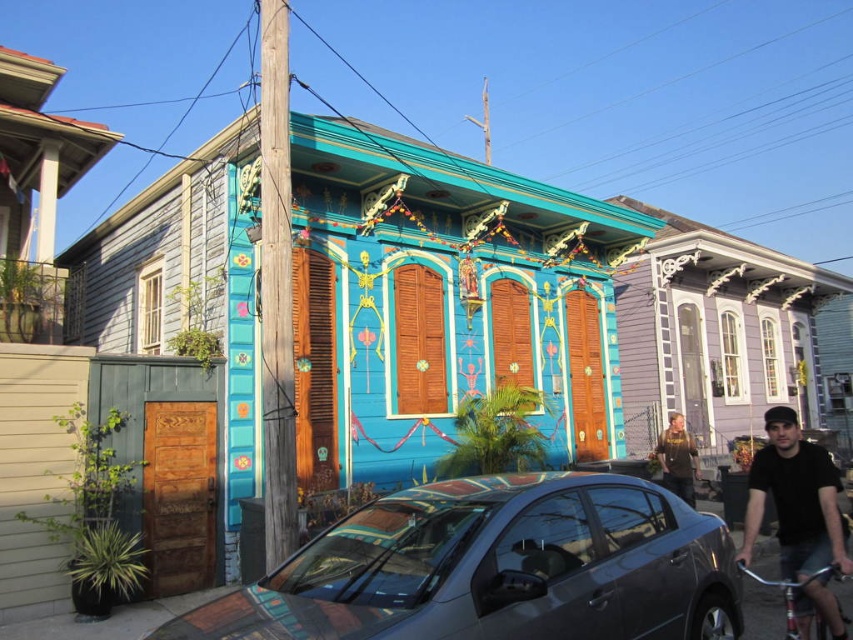
Question: Which point is closer to the camera?

Choices:
 (A) silver metallic bicycle at lower right
 (B) dark brown leather jacket at center
 (C) satin black car at center

Answer: (C)

Question: Which point is closer to the camera?

Choices:
 (A) (582, 589)
 (B) (659, 442)
 (C) (796, 612)
 (D) (834, 556)

Answer: (A)

Question: From the image, what is the correct spatial relationship of satin black car at center in relation to silver metallic bicycle at lower right?

Choices:
 (A) above
 (B) below

Answer: (A)

Question: Which of the following is the closest to the observer?

Choices:
 (A) dark brown leather jacket at center
 (B) silver metallic bicycle at lower right

Answer: (B)

Question: Is dark brown leather jacket at center bigger than silver metallic bicycle at lower right?

Choices:
 (A) yes
 (B) no

Answer: (A)

Question: Does satin black car at center come in front of silver metallic bicycle at lower right?

Choices:
 (A) yes
 (B) no

Answer: (A)